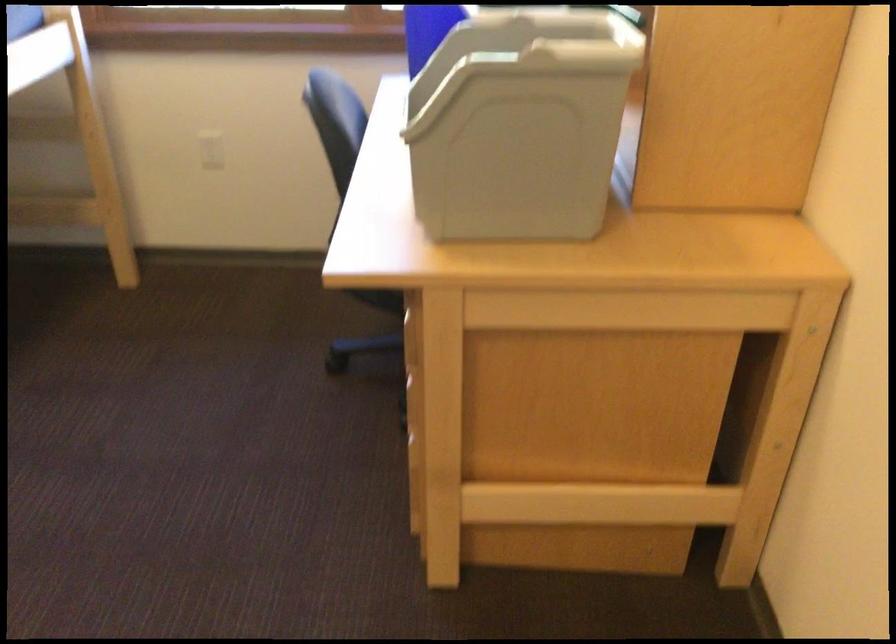
Find where to lift the grey bin handle. Please return your answer as a coordinate pair (x, y).

(565, 24)